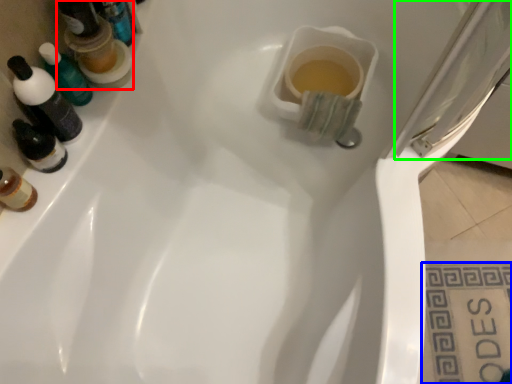
Question: Which object is the closest to the mouthwash (highlighted by a red box)? Choose among these: tile (highlighted by a blue box) or screen door (highlighted by a green box).

Choices:
 (A) tile
 (B) screen door

Answer: (B)